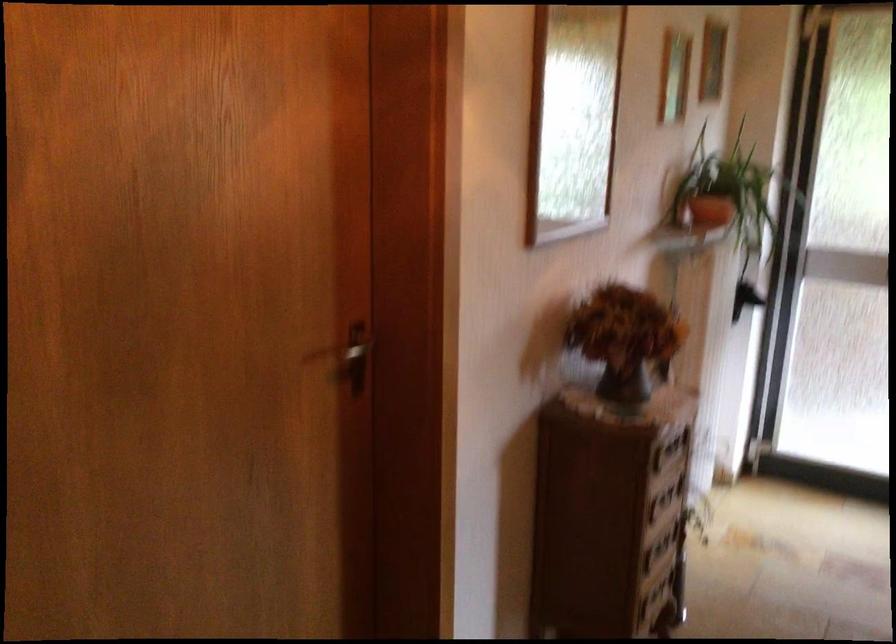
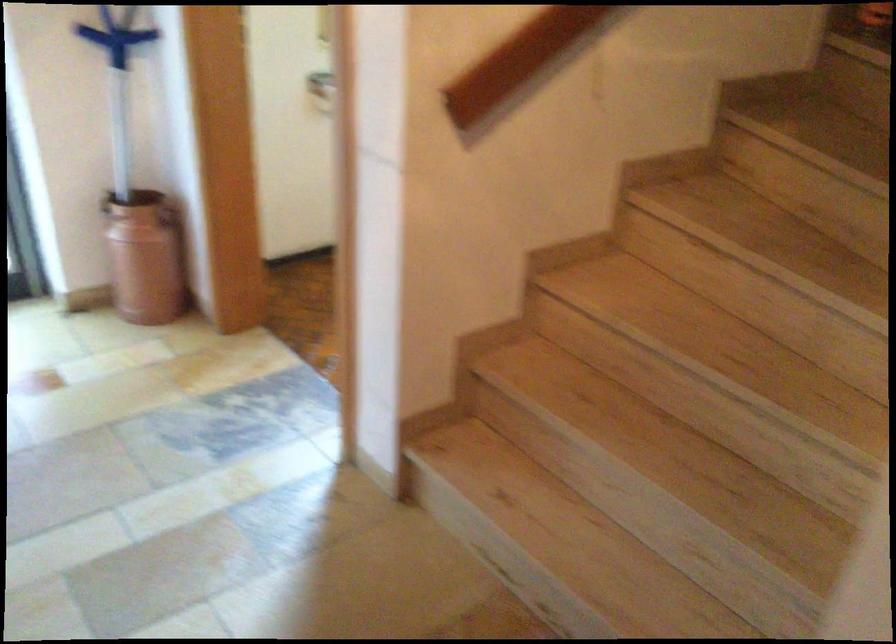
The first image is from the beginning of the video and the second image is from the end. How did the camera likely rotate when shooting the video?

The rotation direction of the camera is right-down.